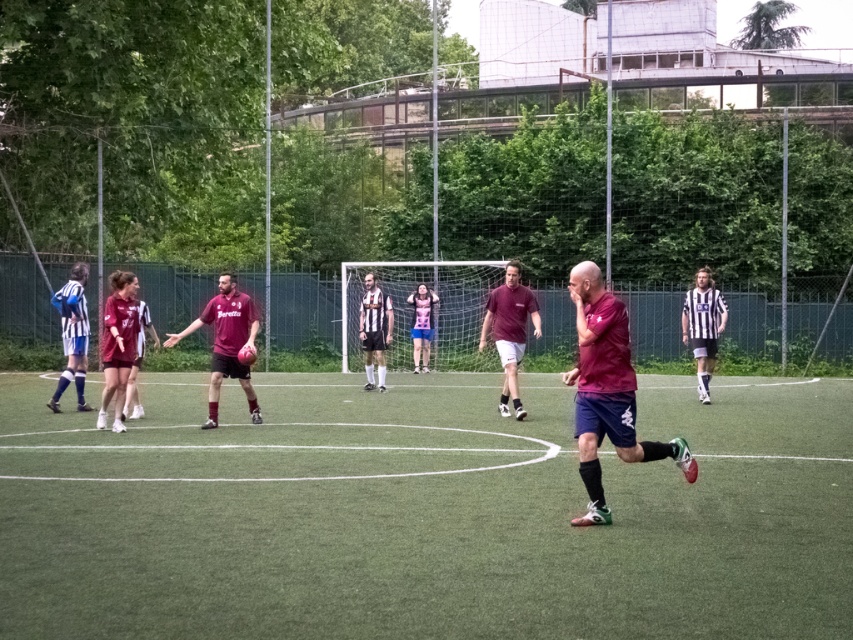
You are a soccer referee observing the match. You notice the matte maroon shirt at center and the striped jersey at center. Which player is closer to the ball?

The matte maroon shirt at center is in front of the striped jersey at center, so the matte maroon shirt at center is closer to the ball.

You are a photographer trying to capture a closeup of both the matte maroon shirt at center and the striped jersey at center during the soccer match. Given that your camera lens has a fixed focus range that can only accommodate objects of a certain width, which player should you prioritize focusing on to ensure their shirt is clearly visible?

The matte maroon shirt at center has a larger width than the striped jersey at center, so you should prioritize focusing on the matte maroon shirt at center to ensure it fits within the camera lens focus range.

You are a soccer player wearing a maroon jersey at center and you want to move to the ball located at the center of the field. Which direction should you move relative to the green artificial turf at center?

The green artificial turf at center is to the left of maroon jersey at center, so you should move to the right to reach the ball located at the center of the field.